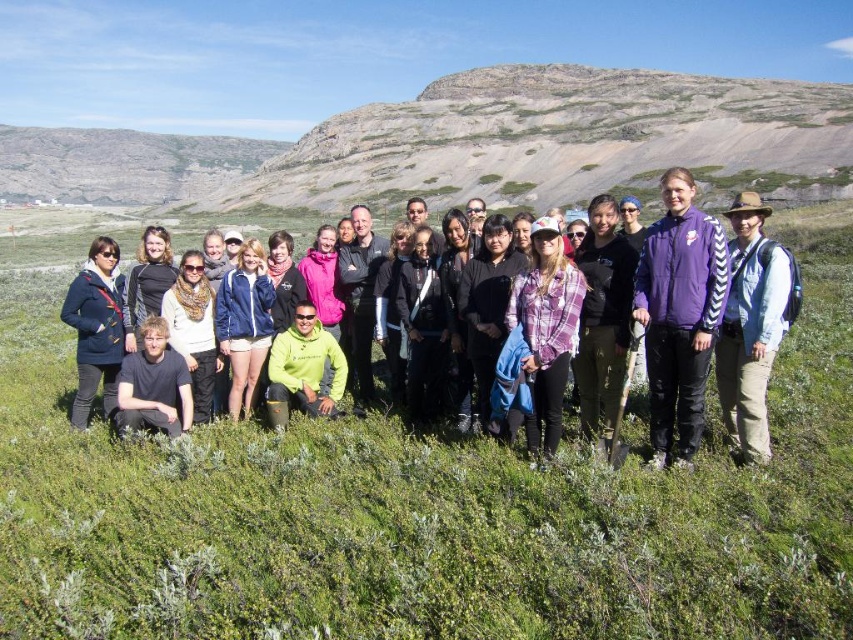
Measure the distance from matte blue jacket at center to neon green fabric at center.

matte blue jacket at center is 7.14 meters from neon green fabric at center.

Is the position of matte blue jacket at center more distant than that of neon green fabric at center?

Yes, it is behind neon green fabric at center.

Is point (247, 326) less distant than point (305, 310)?

No.

Find the location of `matte blue jacket at center`. matte blue jacket at center is located at coordinates (244, 323).

Who is taller, green grassy at center or navy blue jacket at lower left?

Standing taller between the two is green grassy at center.

Which is behind, point (234, 625) or point (86, 314)?

The point (86, 314) is more distant.

Does point (415, 481) come closer to viewer compared to point (96, 250)?

Yes, point (415, 481) is in front of point (96, 250).

Where is `green grassy at center`? green grassy at center is located at coordinates (427, 509).

Consider the image. How much distance is there between green grassy at center and rugged stone hillside at upper left?

green grassy at center is 738.09 meters away from rugged stone hillside at upper left.

Is green grassy at center shorter than rugged stone hillside at upper left?

Correct, green grassy at center is not as tall as rugged stone hillside at upper left.

You are a GUI agent. You are given a task and a screenshot of the screen. Output one action in this format:
    pyautogui.click(x=<x>, y=<y>)
    Task: Click on the green grassy at center
    This screenshot has height=640, width=853.
    Given the screenshot: What is the action you would take?
    pyautogui.click(x=427, y=509)

Find the location of a particular element. green grassy at center is located at coordinates (427, 509).